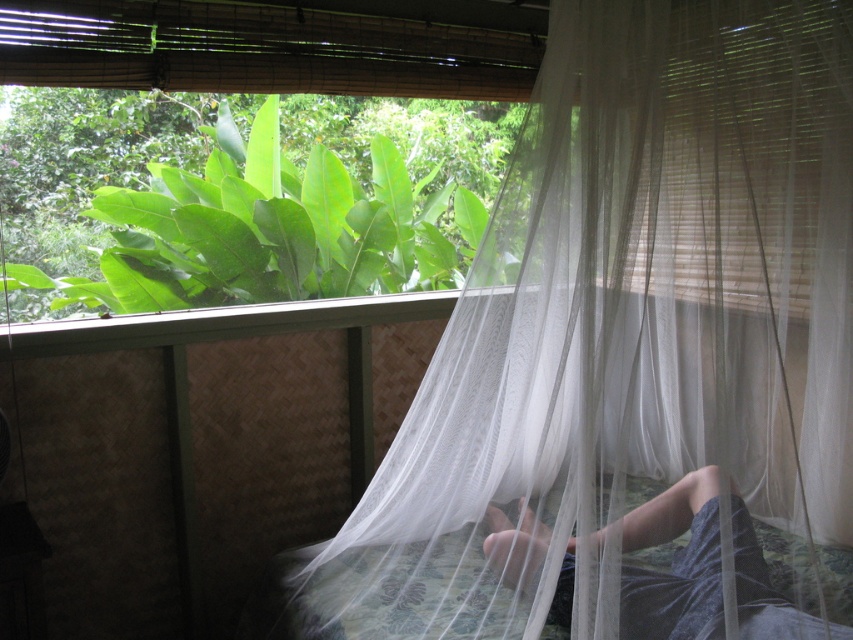
You are standing in the room and want to check the view outside the window. Which object should you move first, the white sheer curtain at center or the dark blue fabric at lower center?

The white sheer curtain at center is to the right of dark blue fabric at lower center. To check the view outside the window, you should move the white sheer curtain at center first since it is positioned over the window area, allowing access to the view.

You are standing in the room looking at the bed. There is a point marked at coordinates (635, 356). What object is located at that point?

The point (635, 356) marks the white sheer curtain at center.